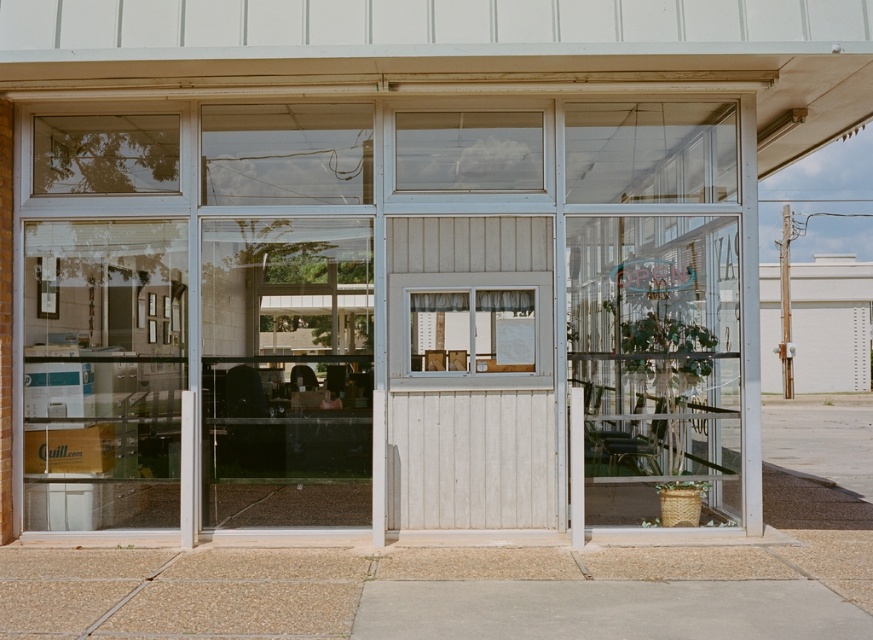
Question: Does transparent glass window at center come behind matte white window at center?

Choices:
 (A) yes
 (B) no

Answer: (A)

Question: Does transparent glass door at center appear on the left side of transparent glass window at center?

Choices:
 (A) yes
 (B) no

Answer: (A)

Question: Which object is farther from the camera taking this photo?

Choices:
 (A) matte white window at center
 (B) transparent glass window at center

Answer: (B)

Question: Considering the real-world distances, which object is closest to the matte white window at center?

Choices:
 (A) clear glass door at center
 (B) transparent glass door at center
 (C) transparent glass window at center

Answer: (C)

Question: Among these objects, which one is farthest from the camera?

Choices:
 (A) transparent glass door at center
 (B) clear glass door at center

Answer: (B)

Question: Considering the relative positions of transparent glass door at center and transparent glass window at center in the image provided, where is transparent glass door at center located with respect to transparent glass window at center?

Choices:
 (A) left
 (B) right

Answer: (A)